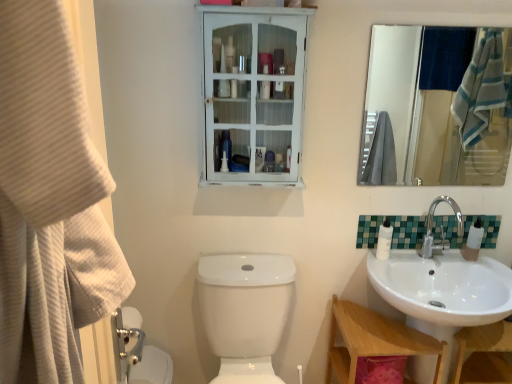
Question: Does translucent plastic soap dispenser at sink right have a lesser height compared to white distressed wood medicine cabinet at upper center?

Choices:
 (A) no
 (B) yes

Answer: (B)

Question: Are translucent plastic soap dispenser at sink right and white distressed wood medicine cabinet at upper center making contact?

Choices:
 (A) yes
 (B) no

Answer: (B)

Question: Can you confirm if translucent plastic soap dispenser at sink right is thinner than white distressed wood medicine cabinet at upper center?

Choices:
 (A) no
 (B) yes

Answer: (B)

Question: Does translucent plastic soap dispenser at sink right appear on the left side of white distressed wood medicine cabinet at upper center?

Choices:
 (A) yes
 (B) no

Answer: (B)

Question: Would you say translucent plastic soap dispenser at sink right is outside white distressed wood medicine cabinet at upper center?

Choices:
 (A) no
 (B) yes

Answer: (B)

Question: Is white distressed wood medicine cabinet at upper center located within translucent plastic soap dispenser at sink right?

Choices:
 (A) no
 (B) yes

Answer: (A)

Question: Is translucent plastic soap dispenser at sink right further to the viewer compared to green mosaic tile at right?

Choices:
 (A) no
 (B) yes

Answer: (A)

Question: Is green mosaic tile at right located within translucent plastic soap dispenser at sink right?

Choices:
 (A) no
 (B) yes

Answer: (A)

Question: Does translucent plastic soap dispenser at sink right have a lesser height compared to green mosaic tile at right?

Choices:
 (A) yes
 (B) no

Answer: (B)

Question: Considering the relative positions of translucent plastic soap dispenser at sink right and green mosaic tile at right in the image provided, is translucent plastic soap dispenser at sink right to the left of green mosaic tile at right from the viewer's perspective?

Choices:
 (A) no
 (B) yes

Answer: (A)

Question: Can you confirm if translucent plastic soap dispenser at sink right is positioned to the right of green mosaic tile at right?

Choices:
 (A) no
 (B) yes

Answer: (B)

Question: Is translucent plastic soap dispenser at sink right positioned far away from green mosaic tile at right?

Choices:
 (A) no
 (B) yes

Answer: (A)

Question: Considering the relative positions of chrome metallic faucet at right and translucent plastic soap dispenser at sink right in the image provided, is chrome metallic faucet at right to the left of translucent plastic soap dispenser at sink right from the viewer's perspective?

Choices:
 (A) no
 (B) yes

Answer: (B)